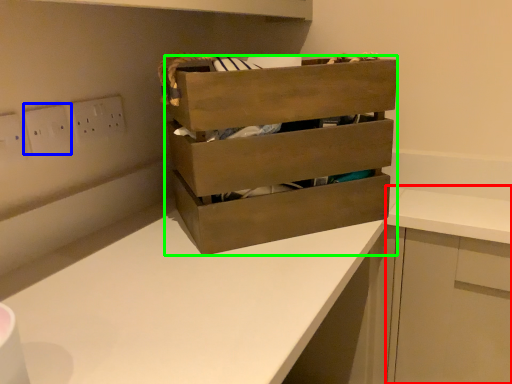
Question: Estimate the real-world distances between objects in this image. Which object is closer to cabinetry (highlighted by a red box), electric outlet (highlighted by a blue box) or chest of drawers (highlighted by a green box)?

Choices:
 (A) electric outlet
 (B) chest of drawers

Answer: (B)